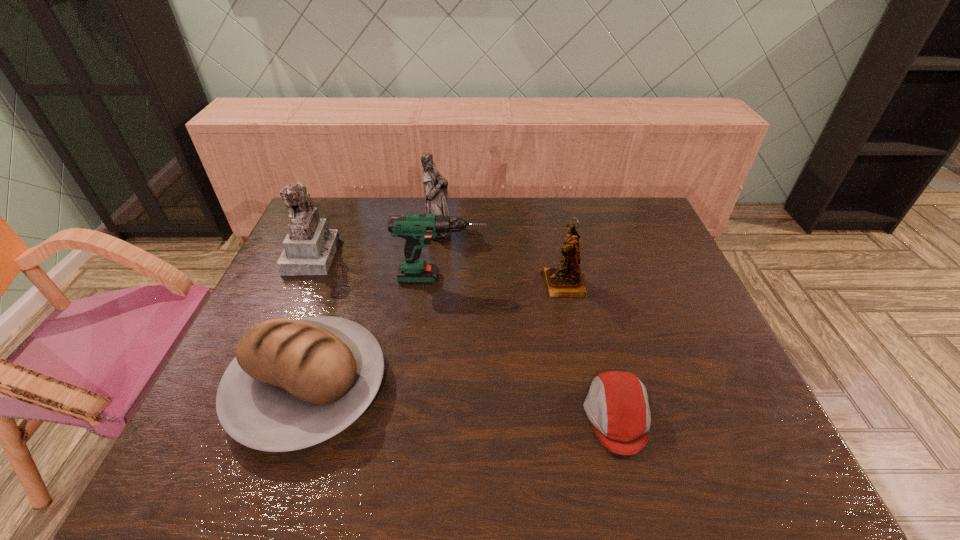
Find the location of a particular element. The image size is (960, 540). free spot located on the front-facing side of the shortest figurine is located at coordinates (443, 285).

At what (x,y) coordinates should I click in order to perform the action: click on free space located 0.360m on the front-facing side of the shortest figurine. Please return your answer as a coordinate pair (x, y). Looking at the image, I should click on (419, 285).

Where is `vacant space located on the right of the bread`? This screenshot has width=960, height=540. vacant space located on the right of the bread is located at coordinates (416, 387).

The width and height of the screenshot is (960, 540). I want to click on free spot located 0.210m on the front-facing side of the cap, so click(489, 417).

You are a GUI agent. You are given a task and a screenshot of the screen. Output one action in this format:
    pyautogui.click(x=<x>, y=<y>)
    Task: Click on the free space located 0.260m on the front-facing side of the cap
    
    Given the screenshot: What is the action you would take?
    pyautogui.click(x=466, y=417)

This screenshot has height=540, width=960. I want to click on vacant region located 0.310m on the front-facing side of the cap, so click(443, 417).

Identify the location of bread that is at the near edge. This screenshot has width=960, height=540. (293, 384).

Identify the location of cap that is at the near edge. The height and width of the screenshot is (540, 960). (617, 405).

I want to click on figurine present at the left edge, so click(309, 247).

The height and width of the screenshot is (540, 960). What are the coordinates of `bread positioned at the left edge` in the screenshot? It's located at (293, 384).